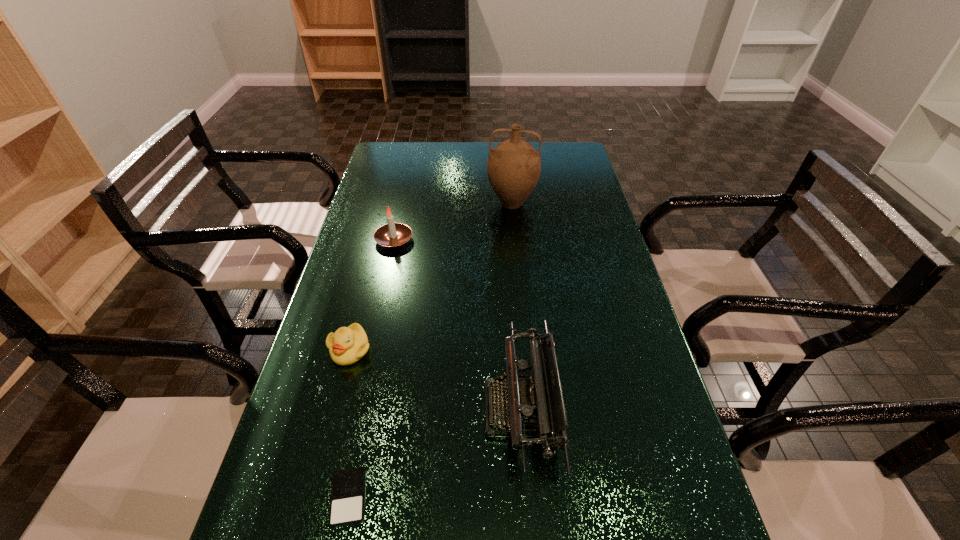
Where is `free space located on the typing side of the typewriter`? The height and width of the screenshot is (540, 960). free space located on the typing side of the typewriter is located at coordinates (373, 409).

The height and width of the screenshot is (540, 960). I want to click on vacant space located at the face of the second shortest object, so click(x=324, y=452).

Locate an element on the screen. free space located 0.180m on the back of the iPod is located at coordinates click(371, 390).

Identify the location of candle positioned at the left edge. The image size is (960, 540). (392, 235).

The height and width of the screenshot is (540, 960). In order to click on duckling positioned at the left edge in this screenshot , I will do `click(347, 345)`.

At what (x,y) coordinates should I click in order to perform the action: click on iPod that is at the left edge. Please return your answer as a coordinate pair (x, y). Looking at the image, I should click on (347, 501).

In the image, there is a desktop. Where is `free space at the far edge`? free space at the far edge is located at coordinates point(432,149).

Locate an element on the screen. free location at the left edge is located at coordinates coord(349,304).

Identify the location of vacant area at the right edge. (581, 244).

Find the location of a particular element. This screenshot has height=540, width=960. free space between the fourth tallest object and the second farthest object is located at coordinates (372, 294).